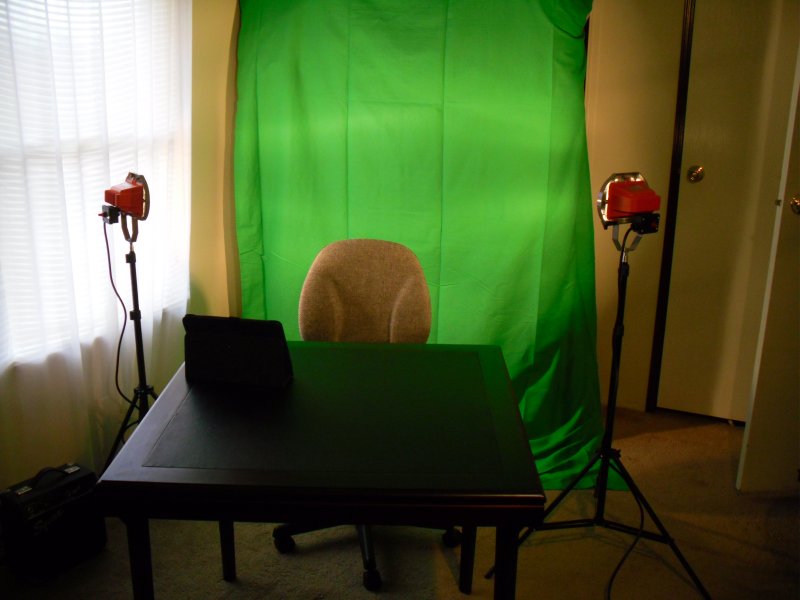
This screenshot has width=800, height=600. Identify the location of door. (721, 250).